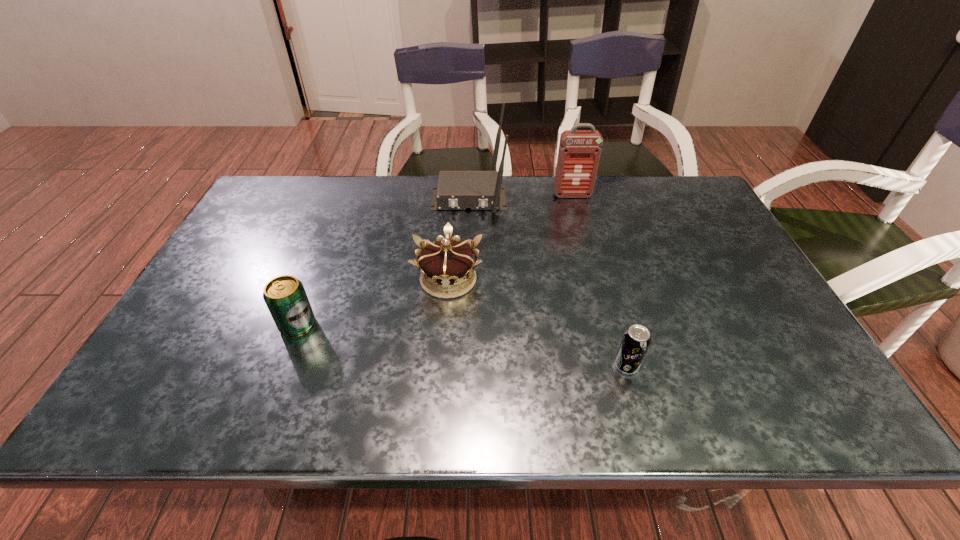
Where is `vacant region that satisfies the following two spatial constraints: 1. on the front-facing side of the first-aid kit; 2. on the right side of the nearest object`? The height and width of the screenshot is (540, 960). vacant region that satisfies the following two spatial constraints: 1. on the front-facing side of the first-aid kit; 2. on the right side of the nearest object is located at coordinates (618, 366).

Locate an element on the screen. The height and width of the screenshot is (540, 960). vacant area that satisfies the following two spatial constraints: 1. on the back of the router to connect cables; 2. on the left side of the nearest object is located at coordinates pyautogui.click(x=464, y=366).

Locate an element on the screen. This screenshot has width=960, height=540. vacant point that satisfies the following two spatial constraints: 1. on the back side of the third farthest object; 2. on the left side of the beer can is located at coordinates (315, 279).